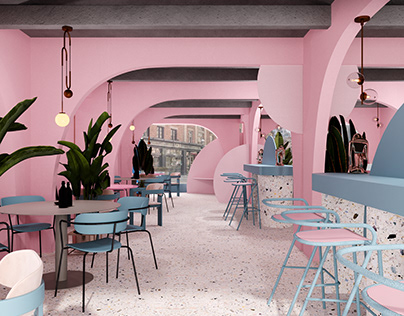
Locate an element on the screen. The image size is (404, 316). floor is located at coordinates (206, 254), (187, 204), (128, 305).